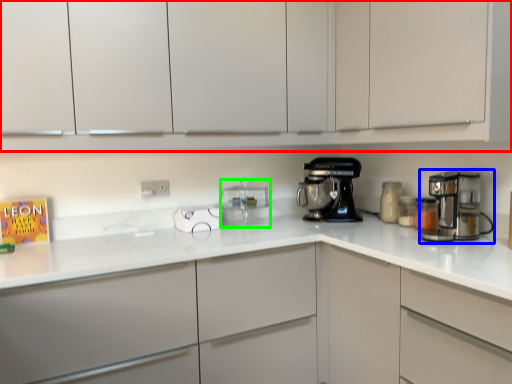
Question: Estimate the real-world distances between objects in this image. Which object is closer to cabinetry (highlighted by a red box), mixer (highlighted by a blue box) or kitchen appliance (highlighted by a green box)?

Choices:
 (A) mixer
 (B) kitchen appliance

Answer: (A)